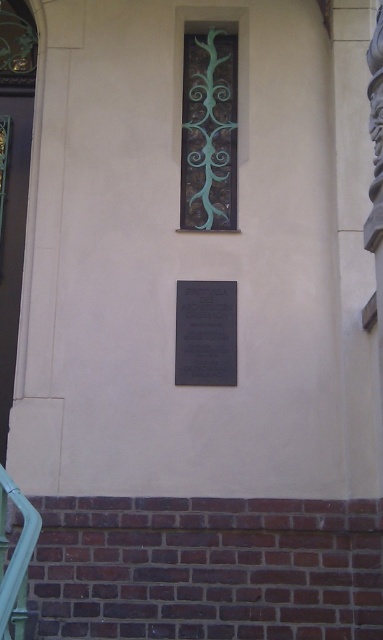
Question: Estimate the real-world distances between objects in this image. Which object is closer to the green glass window at center?

Choices:
 (A) black polished stone plaque at center
 (B) green matte rail at lower left

Answer: (A)

Question: Which object is the farthest from the green glass window at center?

Choices:
 (A) black polished stone plaque at center
 (B) green matte rail at lower left

Answer: (B)

Question: Is green glass window at center below green matte rail at lower left?

Choices:
 (A) no
 (B) yes

Answer: (A)

Question: Does green glass window at center have a smaller size compared to green matte rail at lower left?

Choices:
 (A) yes
 (B) no

Answer: (B)

Question: Which object is the farthest from the black polished stone plaque at center?

Choices:
 (A) green matte rail at lower left
 (B) green glass window at center

Answer: (A)

Question: From the image, what is the correct spatial relationship of black polished stone plaque at center in relation to green matte rail at lower left?

Choices:
 (A) right
 (B) left

Answer: (A)